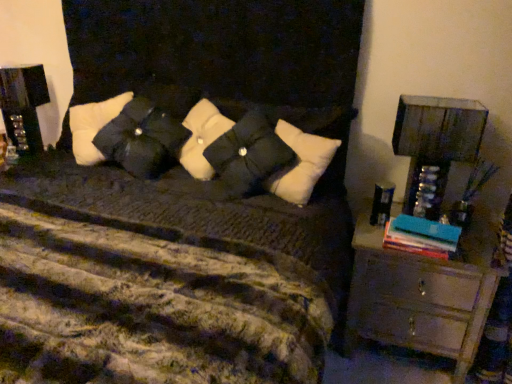
Describe the element at coordinates (417, 300) in the screenshot. I see `wooden chest of drawers at right` at that location.

Measure the distance between point (x=447, y=270) and camera.

Point (x=447, y=270) is 5.60 feet away from camera.

The image size is (512, 384). What are the coordinates of `teal matte book at right` in the screenshot? It's located at (421, 236).

Locate an element on the screen. This screenshot has width=512, height=384. wooden chest of drawers at right is located at coordinates (417, 300).

Is wooden chest of drawers at right in front of or behind black matte pillow at center in the image?

Clearly, wooden chest of drawers at right is in front of black matte pillow at center.

From a real-world perspective, between wooden chest of drawers at right and black matte pillow at center, who is vertically higher?

black matte pillow at center.

Which object is wider, wooden chest of drawers at right or black matte pillow at center?

wooden chest of drawers at right is wider.

Which is closer to the camera, (455, 262) or (134, 147)?

Point (455, 262) is positioned closer to the camera compared to point (134, 147).

Which object is thinner, wooden chest of drawers at right or teal matte book at right?

teal matte book at right is thinner.

Which point is more forward, (472, 348) or (434, 254)?

Point (434, 254)

Between wooden chest of drawers at right and teal matte book at right, which one has larger size?

wooden chest of drawers at right is bigger.

Can you see teal matte book at right touching black matte pillow at center?

There is a gap between teal matte book at right and black matte pillow at center.

Is teal matte book at right aimed at black matte pillow at center?

No, teal matte book at right is not oriented towards black matte pillow at center.

Can you tell me how much teal matte book at right and black matte pillow at center differ in facing direction?

teal matte book at right and black matte pillow at center are facing 14.7 degrees away from each other.

Considering the sizes of objects teal matte book at right and black matte pillow at center in the image provided, who is shorter, teal matte book at right or black matte pillow at center?

With less height is teal matte book at right.

Based on the photo, looking at their sizes, would you say black matte pillow at center is wider or thinner than teal matte book at right?

Clearly, black matte pillow at center has more width compared to teal matte book at right.

Is black matte pillow at center positioned far away from teal matte book at right?

No, there isn't a large distance between black matte pillow at center and teal matte book at right.

The image size is (512, 384). Identify the location of book that appears below the black matte pillow at center (from a real-world perspective). (421, 236).

From the picture: Between black matte pillow at center and teal matte book at right, which one has larger size?

Bigger between the two is black matte pillow at center.

Considering the positions of objects black glossy speaker at left and wooden chest of drawers at right in the image provided, who is behind, black glossy speaker at left or wooden chest of drawers at right?

black glossy speaker at left is more distant.

From the image's perspective, does black glossy speaker at left appear higher than wooden chest of drawers at right?

Yes.

How far apart are black glossy speaker at left and wooden chest of drawers at right?

black glossy speaker at left and wooden chest of drawers at right are 5.76 feet apart.

Is black glossy speaker at left facing away from wooden chest of drawers at right?

No.

Do you think teal matte book at right is within wooden chest of drawers at right, or outside of it?

teal matte book at right is located beyond the bounds of wooden chest of drawers at right.

Does point (442, 253) appear closer or farther from the camera than point (359, 288)?

Point (442, 253).

Is teal matte book at right in contact with wooden chest of drawers at right?

No, teal matte book at right is not touching wooden chest of drawers at right.

Considering the relative sizes of teal matte book at right and wooden chest of drawers at right in the image provided, is teal matte book at right wider than wooden chest of drawers at right?

In fact, teal matte book at right might be narrower than wooden chest of drawers at right.

Looking at this image, can black glossy speaker at left be found inside teal matte book at right?

No, black glossy speaker at left is not inside teal matte book at right.

Identify the location of book on the right of black glossy speaker at left. (421, 236).

Is teal matte book at right looking in the opposite direction of black glossy speaker at left?

No, teal matte book at right's orientation is not away from black glossy speaker at left.

From a real-world perspective, is teal matte book at right physically above black glossy speaker at left?

No, from a real-world perspective, teal matte book at right is not on top of black glossy speaker at left.

At what (x,y) coordinates should I click in order to perform the action: click on pillow behind the wooden chest of drawers at right. Please return your answer as a coordinate pair (x, y). The height and width of the screenshot is (384, 512). Looking at the image, I should click on (142, 139).

Locate an element on the screen. the chest of drawers in front of the teal matte book at right is located at coordinates (417, 300).

When comparing their distances from black matte pillow at center, does wooden chest of drawers at right or teal matte book at right seem closer?

teal matte book at right.

Based on their spatial positions, is teal matte book at right or black glossy speaker at left further from wooden chest of drawers at right?

black glossy speaker at left.

When comparing their distances from black matte pillow at center, does wooden chest of drawers at right or black glossy speaker at left seem further?

wooden chest of drawers at right.

When comparing their distances from black matte pillow at center, does teal matte book at right or black glossy speaker at left seem closer?

The object closer to black matte pillow at center is black glossy speaker at left.

Which object lies nearer to the anchor point wooden chest of drawers at right, black glossy speaker at left or teal matte book at right?

teal matte book at right is positioned closer to the anchor wooden chest of drawers at right.

Based on their spatial positions, is teal matte book at right or wooden chest of drawers at right further from black matte pillow at center?

wooden chest of drawers at right is further to black matte pillow at center.

Based on their spatial positions, is black glossy speaker at left or wooden chest of drawers at right closer to teal matte book at right?

wooden chest of drawers at right lies closer to teal matte book at right than the other object.

Estimate the real-world distances between objects in this image. Which object is further from black glossy speaker at left, wooden chest of drawers at right or black matte pillow at center?

The object further to black glossy speaker at left is wooden chest of drawers at right.

What are the coordinates of `book between black matte pillow at center and wooden chest of drawers at right from left to right` in the screenshot? It's located at (421, 236).

Locate an element on the screen. pillow situated between black glossy speaker at left and teal matte book at right from left to right is located at coordinates pos(142,139).

This screenshot has height=384, width=512. In order to click on book between black glossy speaker at left and wooden chest of drawers at right in the horizontal direction in this screenshot , I will do `click(421, 236)`.

Image resolution: width=512 pixels, height=384 pixels. What are the coordinates of `pillow between black glossy speaker at left and wooden chest of drawers at right in the horizontal direction` in the screenshot? It's located at (x=142, y=139).